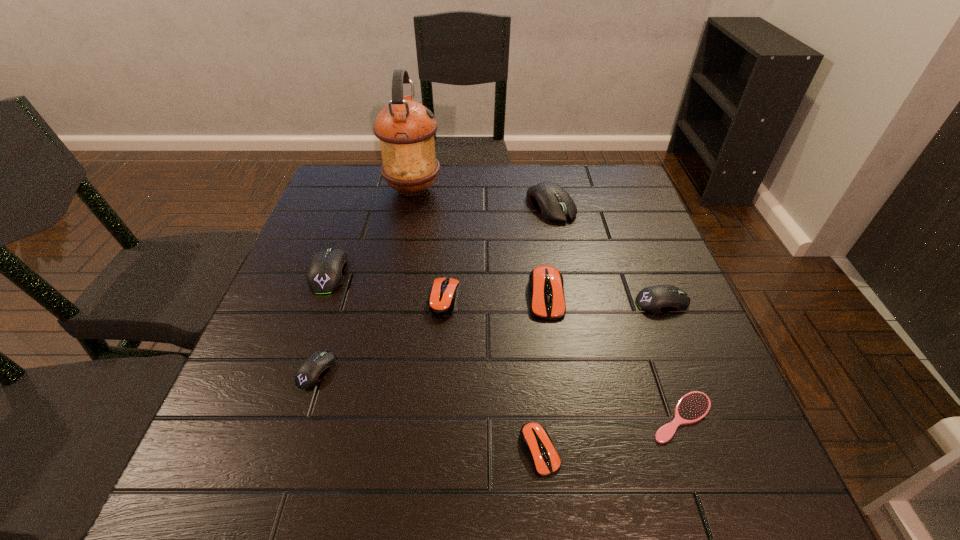
What are the coordinates of `free space between the nearest computer mouse and the oil lamp` in the screenshot? It's located at (476, 320).

Locate an element on the screen. unoccupied area between the leftmost orange computer mouse and the third nearest object is located at coordinates (380, 335).

Locate an element on the screen. object identified as the sixth closest to the leftmost orange computer mouse is located at coordinates (405, 128).

The width and height of the screenshot is (960, 540). What are the coordinates of `object that stands as the fifth closest to the biggest orange computer mouse` in the screenshot? It's located at click(x=536, y=441).

Find the location of a particular element. The image size is (960, 540). the sixth closest computer mouse relative to the biggest orange computer mouse is located at coordinates coord(326,272).

Find the location of a particular element. This screenshot has height=540, width=960. computer mouse that stands as the sixth closest to the biggest orange computer mouse is located at coordinates (326, 272).

What are the coordinates of `black computer equipment that is the second nearest to the smallest orange computer mouse` in the screenshot? It's located at (309, 374).

The height and width of the screenshot is (540, 960). Find the location of `black computer equipment that is the second closest to the rightmost black computer equipment`. black computer equipment that is the second closest to the rightmost black computer equipment is located at coordinates (309, 374).

This screenshot has width=960, height=540. What are the coordinates of `orange computer mouse that can be found as the second closest to the nearest computer mouse` in the screenshot? It's located at (441, 302).

Locate an element on the screen. The width and height of the screenshot is (960, 540). orange computer mouse that is the second closest to the rightmost black computer equipment is located at coordinates (536, 441).